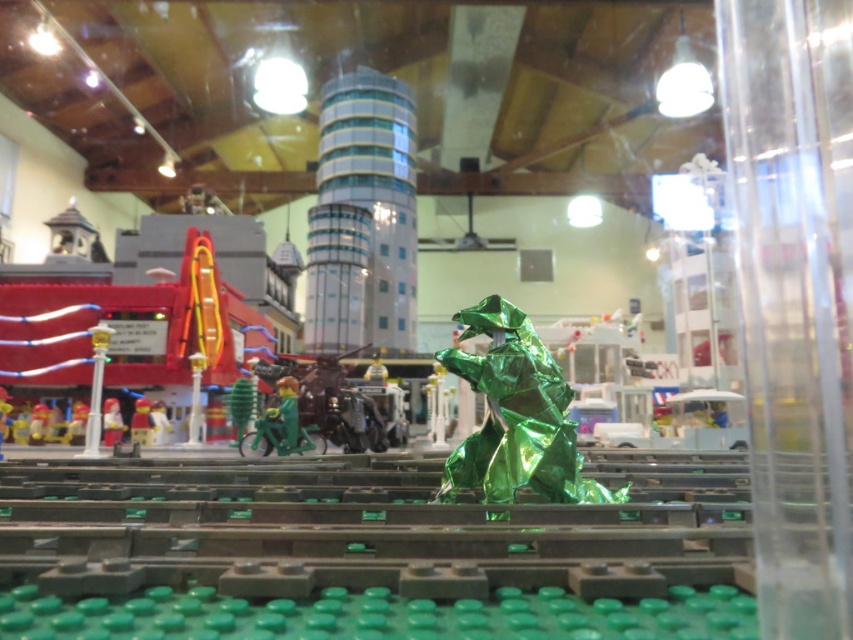
From the picture: Which is more to the left, white glossy tower at center or shiny metallic green dragon at center?

white glossy tower at center

This screenshot has width=853, height=640. Find the location of `white glossy tower at center`. white glossy tower at center is located at coordinates (363, 218).

Which is in front, point (311, 438) or point (134, 404)?

Positioned in front is point (311, 438).

Find the location of a particular element. This screenshot has height=640, width=853. green plastic bicycle at center is located at coordinates (279, 426).

Does shiny metallic green dragon at center have a larger size compared to green plastic bicycle at center?

Correct, shiny metallic green dragon at center is larger in size than green plastic bicycle at center.

Does shiny metallic green dragon at center have a lesser height compared to green plastic bicycle at center?

Incorrect, shiny metallic green dragon at center's height does not fall short of green plastic bicycle at center's.

The image size is (853, 640). In order to click on shiny metallic green dragon at center in this screenshot , I will do [515, 416].

Locate an element on the screen. This screenshot has height=640, width=853. shiny metallic green dragon at center is located at coordinates (515, 416).